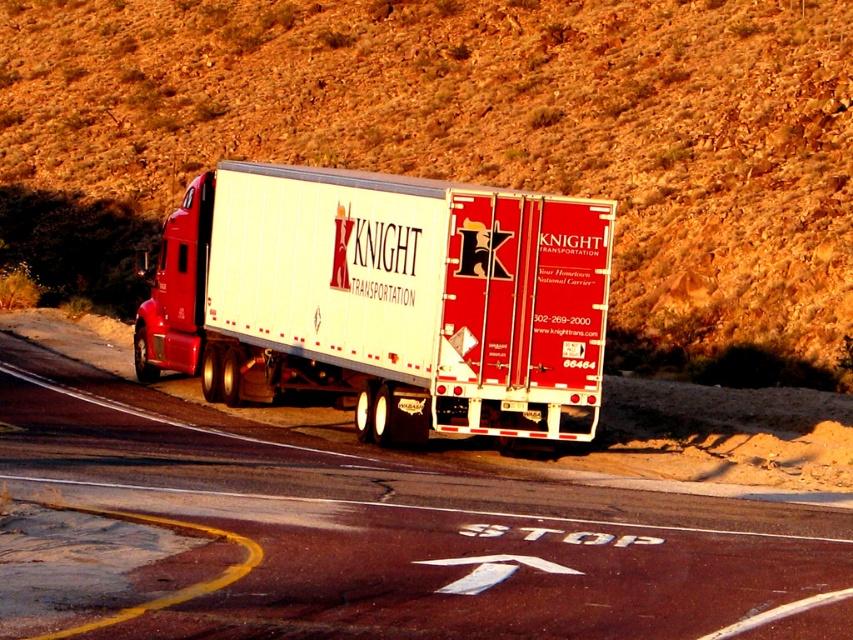
Question: Which object is closer to the camera taking this photo?

Choices:
 (A) brown textured hillside at upper center
 (B) white glossy trailer truck at center

Answer: (B)

Question: Does brown textured hillside at upper center have a larger size compared to smooth asphalt road at center?

Choices:
 (A) no
 (B) yes

Answer: (B)

Question: Which point appears closest to the camera in this image?

Choices:
 (A) (456, 74)
 (B) (392, 200)
 (C) (440, 502)

Answer: (C)

Question: Which point is farther from the camera taking this photo?

Choices:
 (A) (546, 38)
 (B) (287, 273)
 (C) (448, 556)

Answer: (A)

Question: Observing the image, what is the correct spatial positioning of brown textured hillside at upper center in reference to smooth asphalt road at center?

Choices:
 (A) right
 (B) left

Answer: (A)

Question: Can you confirm if smooth asphalt road at center is positioned to the right of white glossy trailer truck at center?

Choices:
 (A) no
 (B) yes

Answer: (A)